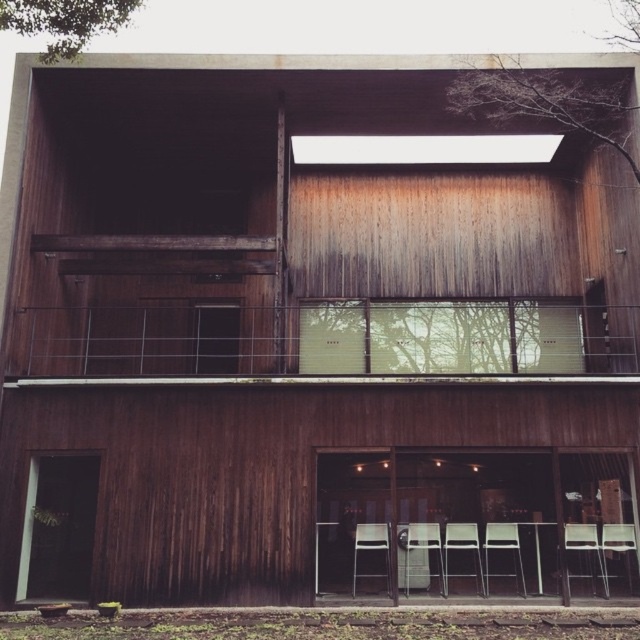
You are sitting on the white plastic chair at lower center and want to move to the matte wood chair at lower right. Which direction should you move to reach it?

The matte wood chair at lower right is above the white plastic chair at lower center, so you should move upward to reach it.

You are sitting on the white plastic chair at lower center and want to move to the metallic silver chair at center. Which direction should you move to reach it?

You should move backward to reach the metallic silver chair at center because the white plastic chair at lower center is in front of it.